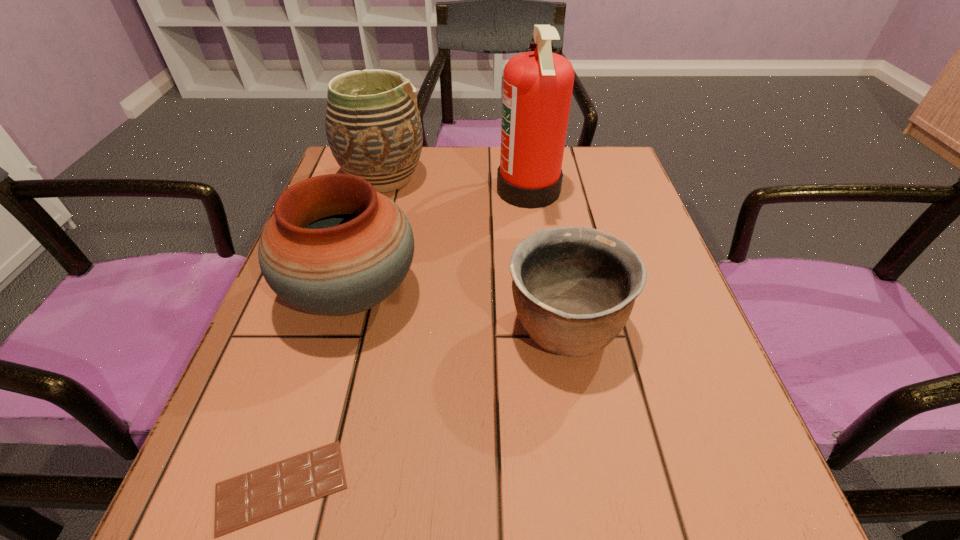
You are a GUI agent. You are given a task and a screenshot of the screen. Output one action in this format:
    pyautogui.click(x=<x>, y=<y>)
    Task: Click on the free space located on the right of the farthest pottery
    The image size is (960, 540).
    Given the screenshot: What is the action you would take?
    pyautogui.click(x=540, y=178)

You are a GUI agent. You are given a task and a screenshot of the screen. Output one action in this format:
    pyautogui.click(x=<x>, y=<y>)
    Task: Click on the vacant space situated 0.260m on the back of the second shortest pottery
    
    Given the screenshot: What is the action you would take?
    pyautogui.click(x=384, y=179)

The width and height of the screenshot is (960, 540). Identify the location of vacant area situated 0.200m on the front of the rightmost pottery. (596, 520).

This screenshot has height=540, width=960. Identify the location of free space located 0.260m on the back of the shortest object. (338, 302).

Find the location of `fire extinguisher located in the far edge section of the desktop`. fire extinguisher located in the far edge section of the desktop is located at coordinates (537, 85).

Locate an element on the screen. This screenshot has width=960, height=540. pottery located at the far edge is located at coordinates (373, 127).

You are a GUI agent. You are given a task and a screenshot of the screen. Output one action in this format:
    pyautogui.click(x=<x>, y=<y>)
    Task: Click on the object present at the near edge
    The height and width of the screenshot is (540, 960).
    Given the screenshot: What is the action you would take?
    pyautogui.click(x=243, y=500)

The image size is (960, 540). I want to click on chocolate bar that is at the left edge, so click(x=243, y=500).

I want to click on object that is at the right edge, so click(x=574, y=288).

Where is `object that is at the far left corner`? This screenshot has width=960, height=540. object that is at the far left corner is located at coordinates (373, 127).